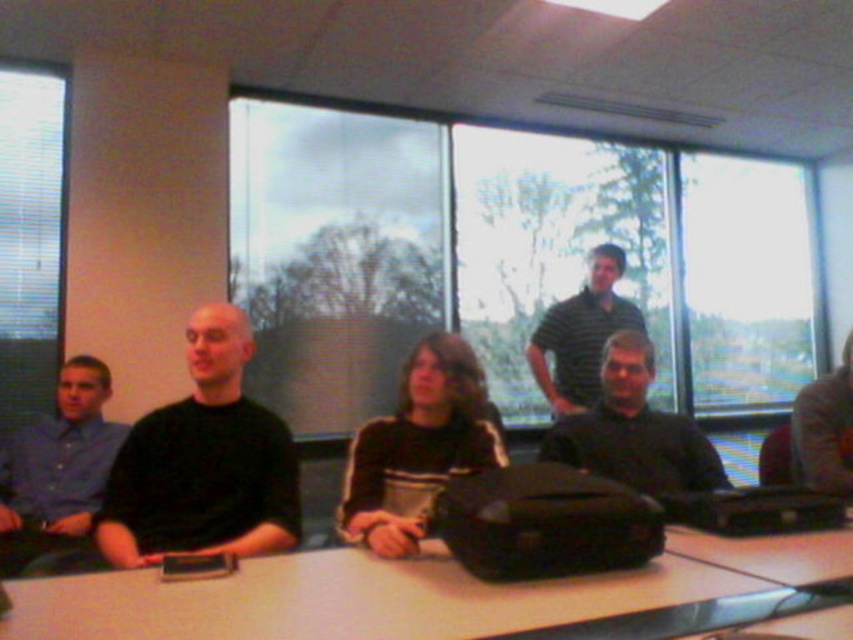
You are a tailor measuring shirts for a group. You need to determine which shirt among the dark gray shirt at center and the striped cotton shirt at center requires a larger size. Based on the image, which shirt should you recommend a larger size for?

The striped cotton shirt at center requires a larger size since it has a greater width than the dark gray shirt at center.

You are standing in the meeting room and want to reach both the point at coordinates (94,509) and the point at coordinates (555,301). Which point should you approach first to minimize the distance walked?

You should approach point (94,509) first because it is closer to you than point (555,301).

You are organizing a photo shoot and need to place two shirts on a mannequin. The blue shirt at left and the striped cotton shirt at center must be arranged so that the narrower one is on top. Which shirt should you place on top?

The blue shirt at left has a lesser width compared to striped cotton shirt at center, so you should place the blue shirt at left on top as it is narrower.